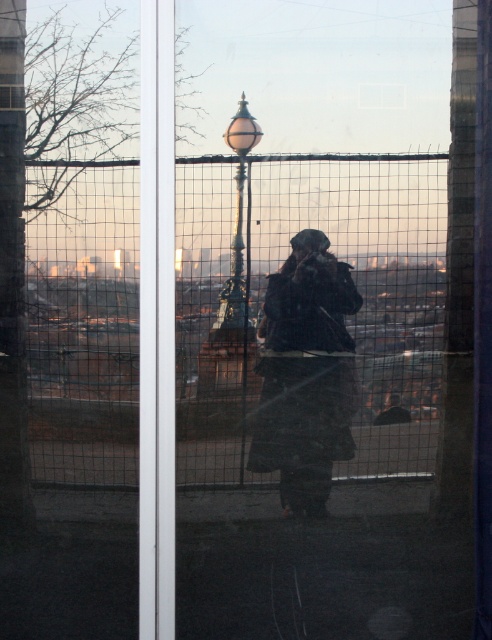
Question: Which of the following is the farthest from the observer?

Choices:
 (A) pyautogui.click(x=303, y=339)
 (B) pyautogui.click(x=330, y=385)
 (C) pyautogui.click(x=375, y=420)

Answer: (B)

Question: Where is wire mesh fence at center located in relation to dark brown leather coat at center in the image?

Choices:
 (A) below
 (B) above

Answer: (B)

Question: Which object is closer to the camera taking this photo?

Choices:
 (A) dark brown leather coat at center
 (B) wire mesh fence at center
 (C) dark gray jacket at center

Answer: (B)

Question: Does wire mesh fence at center have a larger size compared to dark brown leather coat at center?

Choices:
 (A) yes
 (B) no

Answer: (A)

Question: Observing the image, what is the correct spatial positioning of wire mesh fence at center in reference to dark gray jacket at center?

Choices:
 (A) left
 (B) right

Answer: (A)

Question: Which object is positioned closest to the dark gray jacket at center?

Choices:
 (A) dark brown leather coat at center
 (B) wire mesh fence at center

Answer: (A)